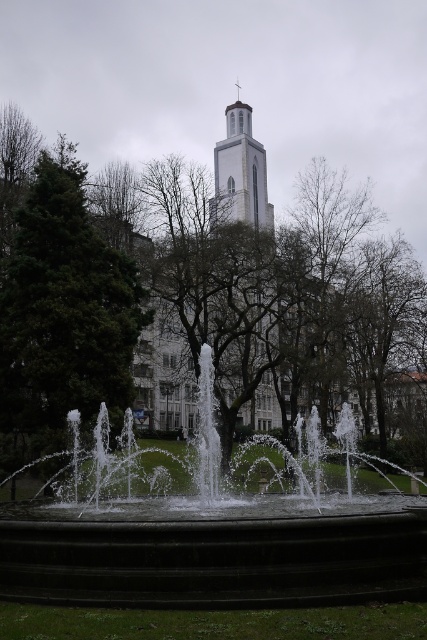
Question: Is white stone tower at center to the left of white stone bell tower at center from the viewer's perspective?

Choices:
 (A) no
 (B) yes

Answer: (A)

Question: Estimate the real-world distances between objects in this image. Which object is farther from the white stone fountain at center?

Choices:
 (A) white stone bell tower at center
 (B) green textured tree at left
 (C) white stone tower at center

Answer: (A)

Question: Which point is closer to the camera?

Choices:
 (A) white stone fountain at center
 (B) white stone bell tower at center
 (C) white stone tower at center
 (D) green textured tree at left

Answer: (A)

Question: Does white stone fountain at center have a smaller size compared to white stone tower at center?

Choices:
 (A) yes
 (B) no

Answer: (A)

Question: Which of these objects is positioned farthest from the white stone bell tower at center?

Choices:
 (A) white stone fountain at center
 (B) white stone tower at center
 (C) green textured tree at left

Answer: (A)

Question: Does green textured tree at left appear on the left side of white stone bell tower at center?

Choices:
 (A) yes
 (B) no

Answer: (A)